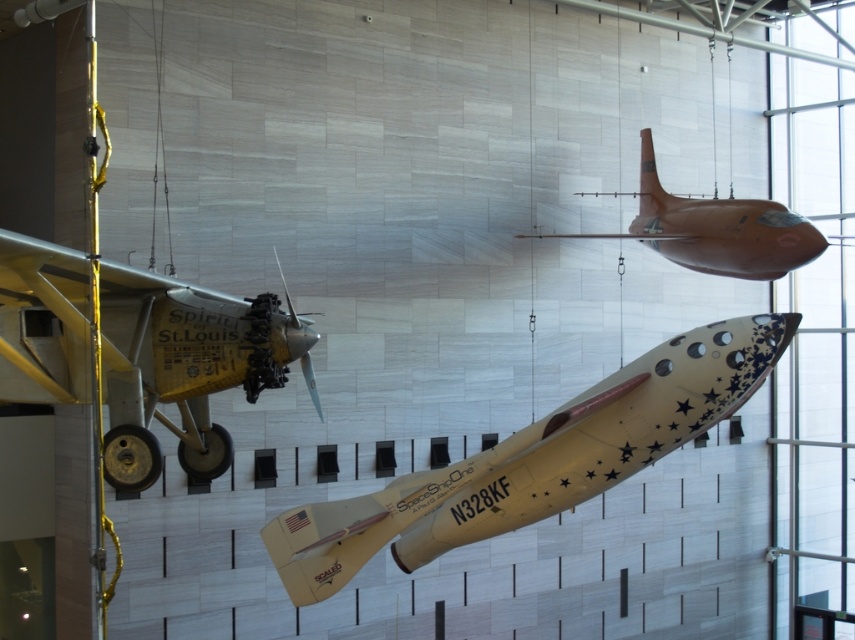
Looking at this image, you are standing in the museum and want to take a photo of both the white glossy rocket at center and the matte orange airplane at upper right. Given that your camera has a maximum focus range of 8 meters, will you be able to capture both objects in sharp focus at the same time?

The white glossy rocket at center is 7.89 meters away from the matte orange airplane at upper right. Since the distance between them is within the camera maximum focus range of 8 meters, you can capture both objects in sharp focus at the same time.

You are an architect designing a new museum exhibit. You need to ensure that the white glossy rocket at center and the matte orange airplane at upper right are displayed in a way that maintains a safe distance between them. Considering their sizes, which object requires more vertical space for proper display?

The white glossy rocket at center requires more vertical space because it is much taller than the matte orange airplane at upper right.

You are a museum visitor standing in front of the white glossy rocket at center and the metallic silver propeller at center. Which object appears bigger to you?

The white glossy rocket at center appears bigger than the metallic silver propeller at center because it has a larger size compared to the propeller.